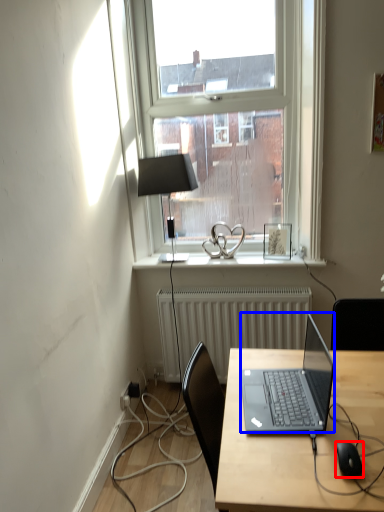
Question: Among these objects, which one is farthest to the camera, computer mouse (highlighted by a red box) or laptop (highlighted by a blue box)?

Choices:
 (A) computer mouse
 (B) laptop

Answer: (B)